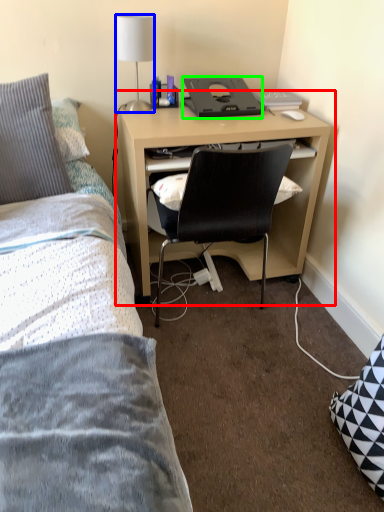
Question: Estimate the real-world distances between objects in this image. Which object is closer to computer desk (highlighted by a red box), lamp (highlighted by a blue box) or desktop (highlighted by a green box)?

Choices:
 (A) lamp
 (B) desktop

Answer: (B)